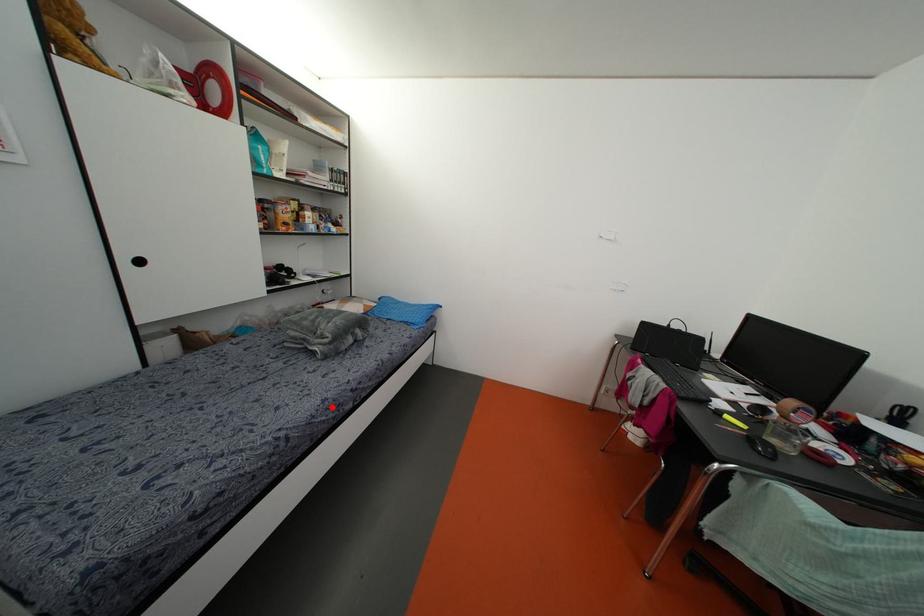
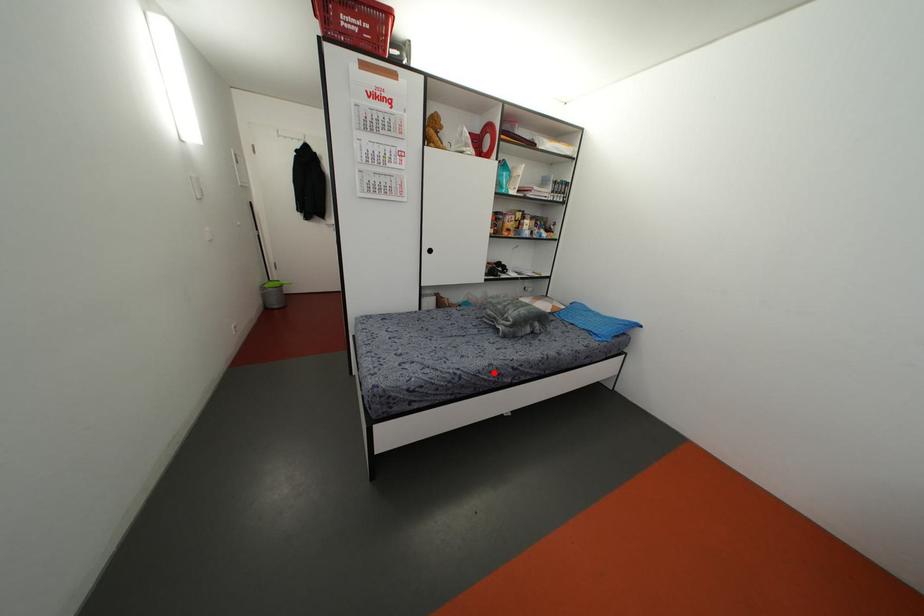
I am providing you with two images of the same scene from different viewpoints. A red point is marked on the first image and another point is marked on the second image. Do the highlighted points in image1 and image2 indicate the same real-world spot?

Yes